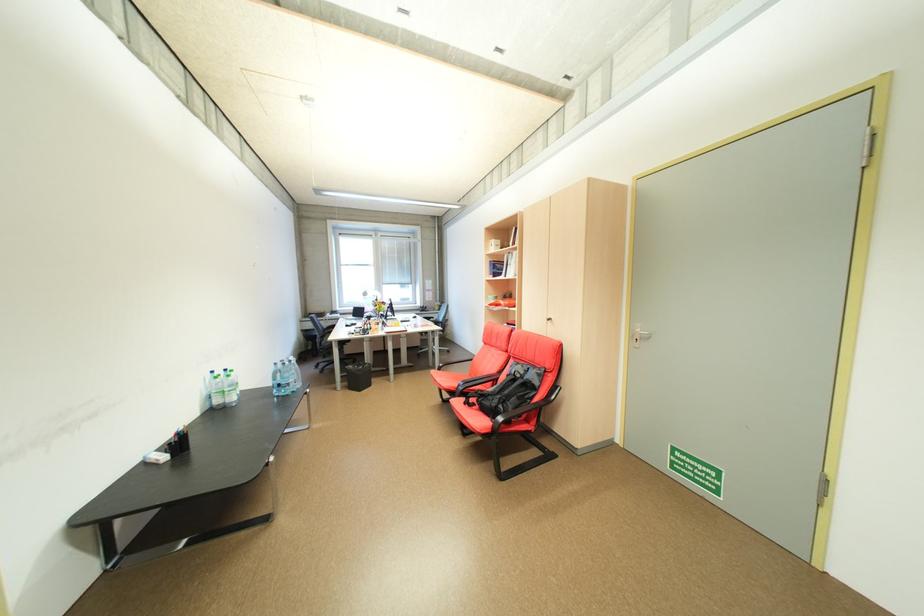
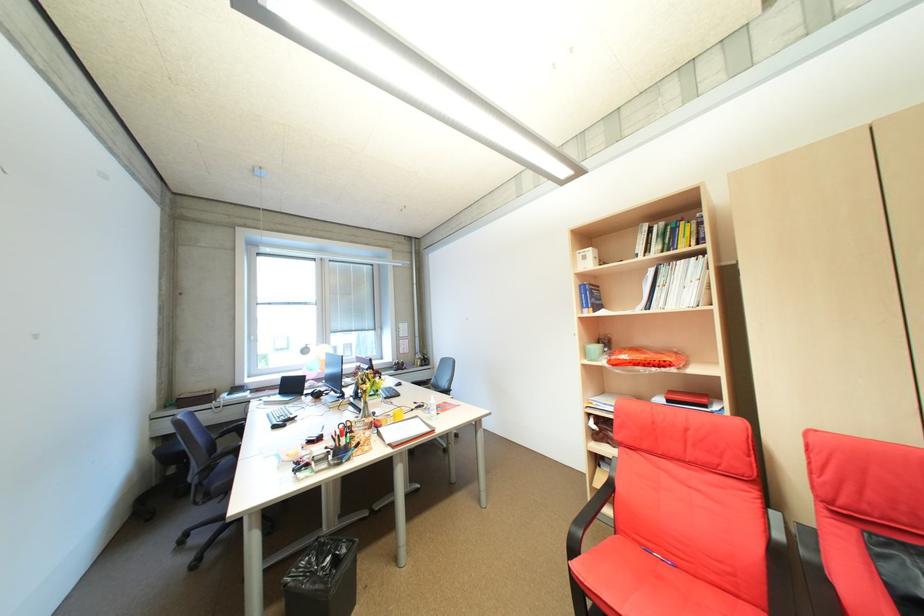
In the second image, find the point that corresponds to point 503,265 in the first image.

(600, 291)